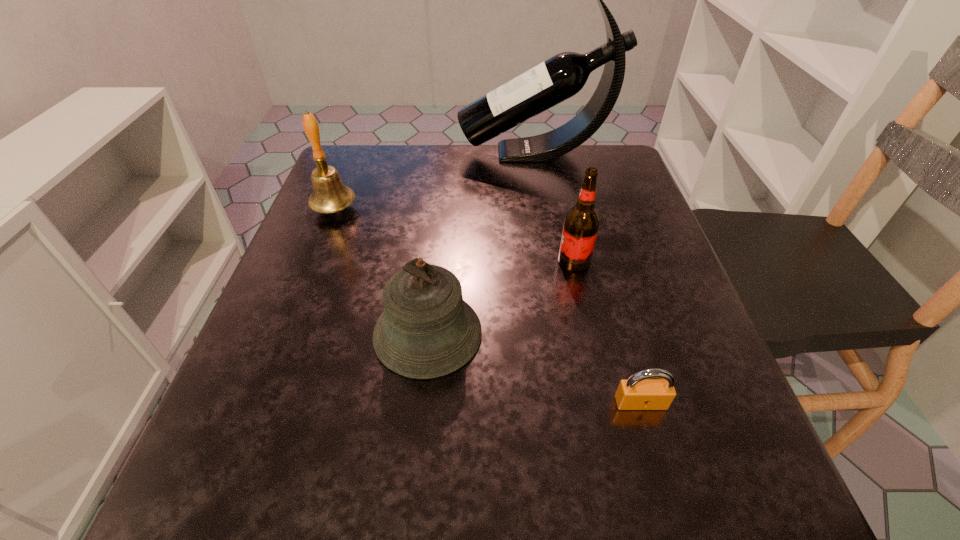
In order to click on free space located 0.140m on the stand of the farthest object in this screenshot , I will do `click(405, 153)`.

Image resolution: width=960 pixels, height=540 pixels. I want to click on vacant space located 0.240m on the stand of the farthest object, so click(368, 153).

Where is `vacant space positioned 0.050m on the right of the farther bell`? The height and width of the screenshot is (540, 960). vacant space positioned 0.050m on the right of the farther bell is located at coordinates (379, 209).

Locate an element on the screen. blank space located on the back of the third nearest object is located at coordinates (564, 212).

Identify the location of blank space located on the back of the fourth tallest object. (443, 193).

Where is `free space located to unlock the padlock from the front`? This screenshot has height=540, width=960. free space located to unlock the padlock from the front is located at coordinates (670, 507).

This screenshot has height=540, width=960. Identify the location of wine bottle at the far edge. (562, 76).

Where is `bell that is at the far edge`? bell that is at the far edge is located at coordinates click(329, 195).

Find the location of a particular element. object present at the left edge is located at coordinates (329, 195).

Locate an element on the screen. This screenshot has width=960, height=540. wine bottle positioned at the right edge is located at coordinates (562, 76).